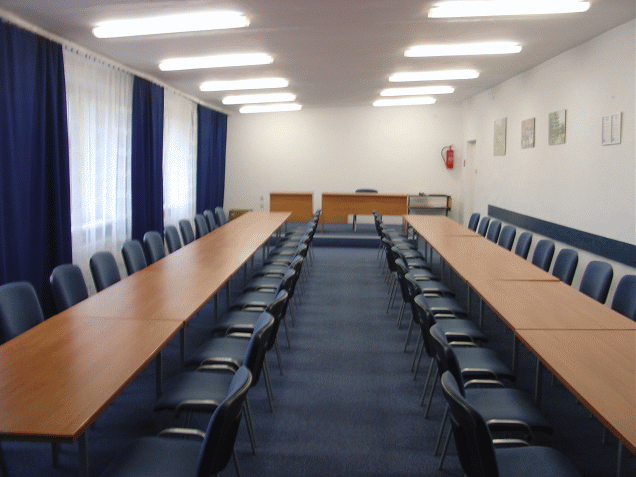
The width and height of the screenshot is (636, 477). I want to click on ceiling, so click(x=350, y=65).